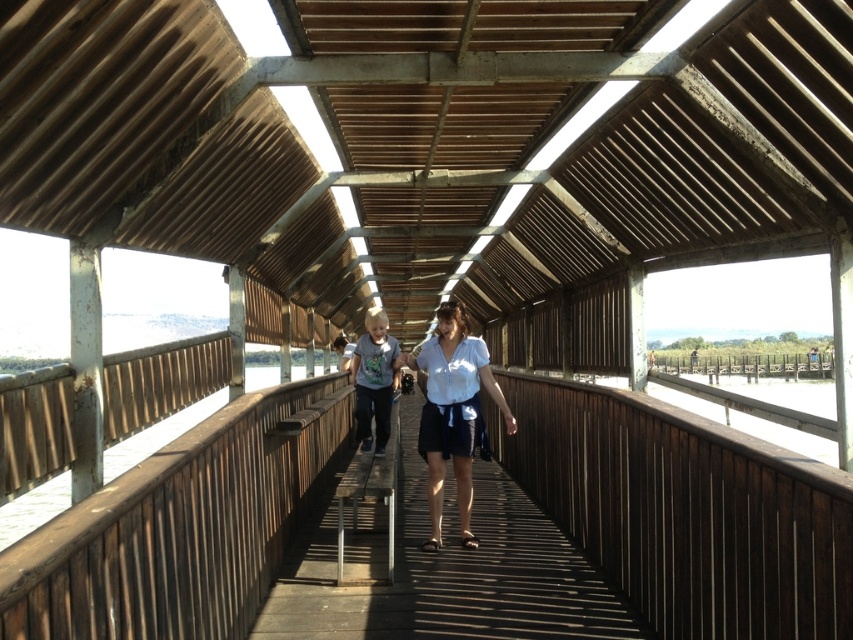
Question: Which point is farther to the camera?

Choices:
 (A) wooden bench at center
 (B) light gray cotton shirt at center

Answer: (A)

Question: Is white cotton shirt at center bigger than light gray cotton shirt at center?

Choices:
 (A) yes
 (B) no

Answer: (A)

Question: Does wooden bench at center appear on the left side of white cotton shirt at center?

Choices:
 (A) no
 (B) yes

Answer: (B)

Question: Does white cotton shirt at center appear under light gray cotton shirt at center?

Choices:
 (A) no
 (B) yes

Answer: (B)

Question: Which point is closer to the camera?

Choices:
 (A) (434, 525)
 (B) (508, 573)
 (C) (358, 340)
 (D) (345, 362)

Answer: (B)

Question: Which of the following is the closest to the observer?

Choices:
 (A) white cotton shirt at center
 (B) light gray cotton shirt at center

Answer: (A)